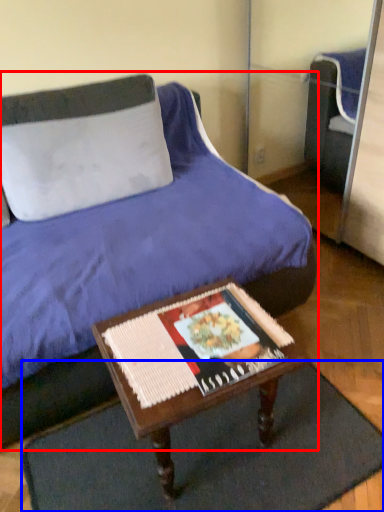
Question: Which object appears farthest to the camera in this image, bed (highlighted by a red box) or doormat (highlighted by a blue box)?

Choices:
 (A) bed
 (B) doormat

Answer: (B)